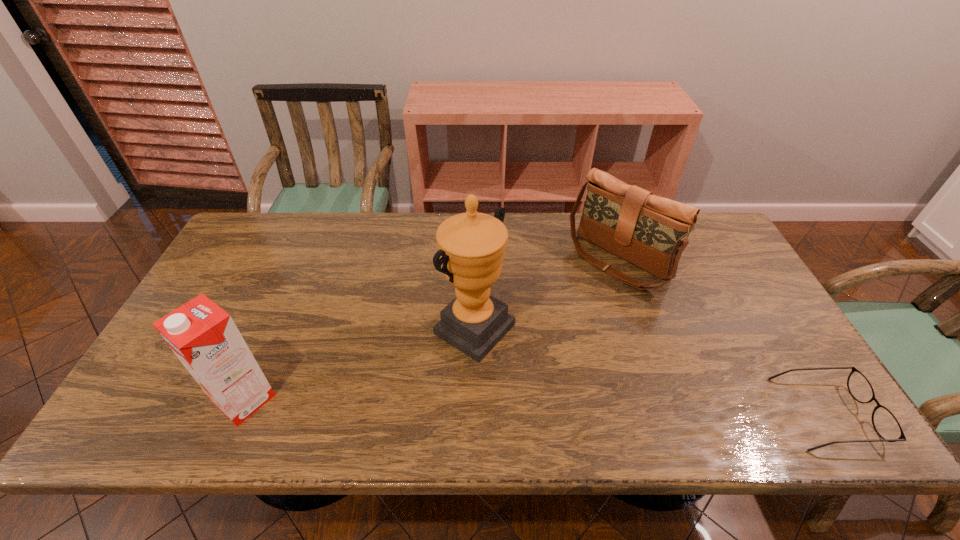
You are a GUI agent. You are given a task and a screenshot of the screen. Output one action in this format:
    pyautogui.click(x=<x>, y=<y>)
    Task: Click on the vacant space situated at the front of the tallest object with handles
    The width and height of the screenshot is (960, 540).
    Given the screenshot: What is the action you would take?
    point(559,380)

Where is `vacant area located at the front of the tallest object with handles`? This screenshot has width=960, height=540. vacant area located at the front of the tallest object with handles is located at coordinates (589, 399).

This screenshot has width=960, height=540. Identify the location of vacant position located on the front-facing side of the shoulder bag. (565, 312).

Locate an element on the screen. This screenshot has height=540, width=960. free space located 0.400m on the front-facing side of the shoulder bag is located at coordinates click(x=500, y=372).

Locate an element on the screen. Image resolution: width=960 pixels, height=540 pixels. vacant space located 0.150m on the front-facing side of the shoulder bag is located at coordinates (562, 315).

Where is `object that is positioned at the far edge`? The image size is (960, 540). object that is positioned at the far edge is located at coordinates (651, 232).

Identify the location of carton located at the near edge. [203, 336].

Where is `spectacles located in the near edge section of the desktop`? This screenshot has width=960, height=540. spectacles located in the near edge section of the desktop is located at coordinates point(886,425).

This screenshot has width=960, height=540. Find the location of `object that is at the right edge`. object that is at the right edge is located at coordinates (886, 425).

Where is `object at the near right corner`? Image resolution: width=960 pixels, height=540 pixels. object at the near right corner is located at coordinates (886, 425).